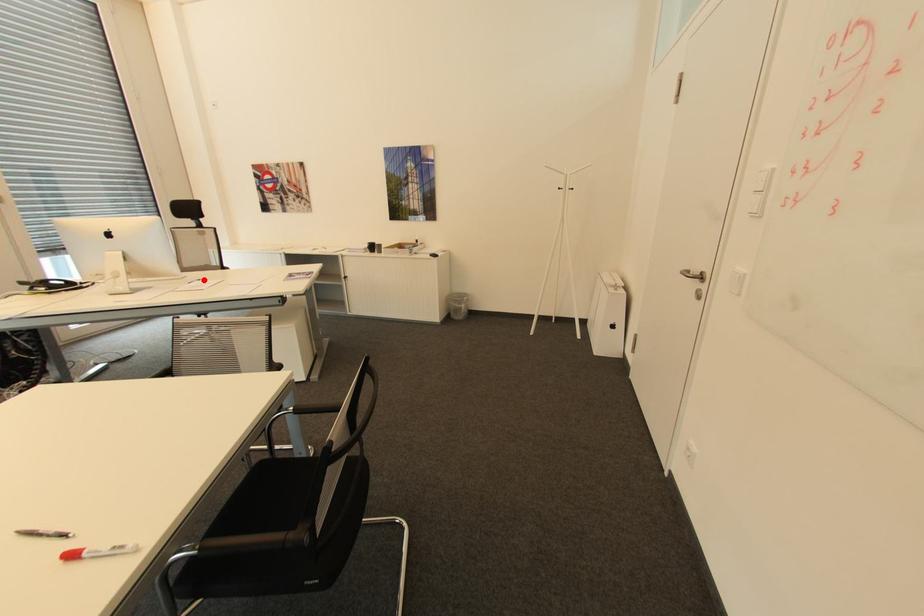
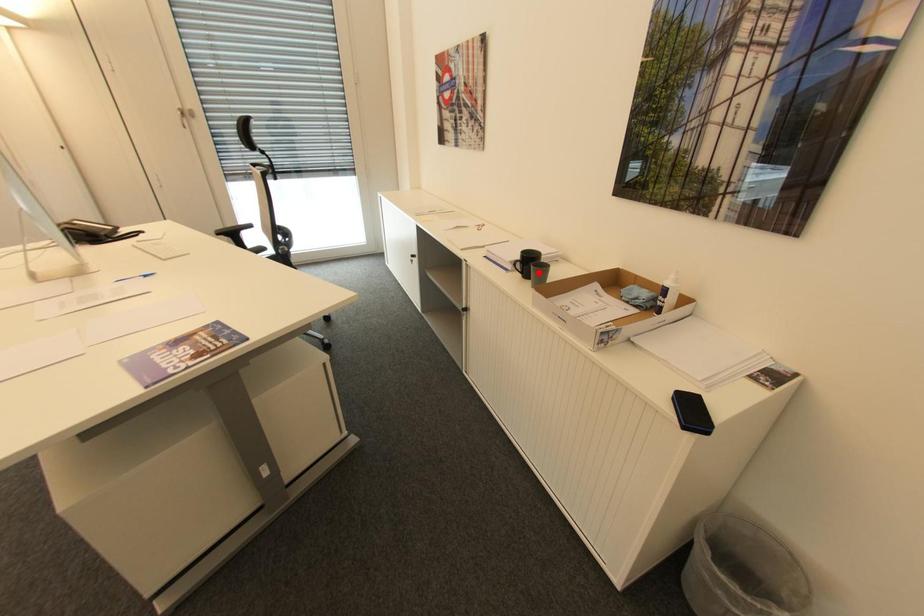
I am providing you with two images of the same scene from different viewpoints. A red point is marked on the first image and another point is marked on the second image. Are the points marked in image1 and image2 representing the same 3D position?

No